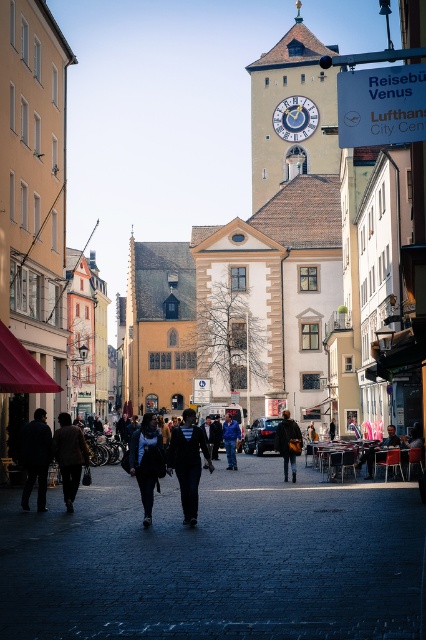
Does metallic silver clock at center lie in front of blue fabric jacket at center?

No, metallic silver clock at center is behind blue fabric jacket at center.

Does metallic silver clock at center have a greater height compared to blue fabric jacket at center?

Yes, metallic silver clock at center is taller than blue fabric jacket at center.

Describe the element at coordinates (294, 118) in the screenshot. The height and width of the screenshot is (640, 426). I see `metallic silver clock at center` at that location.

Identify the location of metallic silver clock at center. (294, 118).

Can you confirm if white stone clock tower at center is positioned below dark gray jacket at lower left?

No, white stone clock tower at center is not below dark gray jacket at lower left.

Can you confirm if white stone clock tower at center is thinner than dark gray jacket at lower left?

No.

Between point (284, 136) and point (42, 500), which one is positioned behind?

The point (284, 136) is more distant.

Where is `white stone clock tower at center`? The height and width of the screenshot is (640, 426). white stone clock tower at center is located at coordinates (291, 112).

Locate an element on the screen. black leather jacket at center is located at coordinates (146, 460).

Does point (143, 522) come in front of point (290, 113)?

Yes.

At what (x,y) coordinates should I click in order to perform the action: click on black leather jacket at center. Please return your answer as a coordinate pair (x, y). Looking at the image, I should click on (146, 460).

Find the location of a particular element. This screenshot has height=640, width=426. black leather jacket at center is located at coordinates (146, 460).